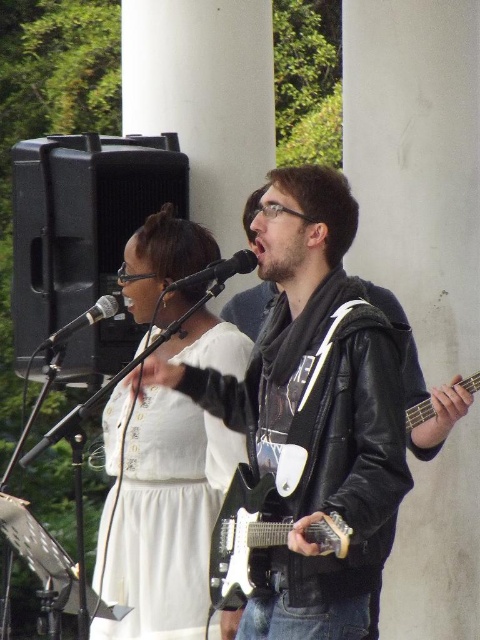
You are setting up a music stand between the black electric guitar at center and the black matte microphone at center. Which object should the stand be placed closer to if you want it to be near the larger object?

The stand should be placed closer to the black electric guitar at center because it is larger than the black matte microphone at center.

You are a photographer at the event and need to capture a closeup shot of the lead vocalist. Given that the white satin dress at center and the black matte microphone at center are both in the frame, which object should you focus on to ensure the microphone is clearly visible?

The black matte microphone at center is smaller than the white satin dress at center, so focusing on the microphone ensures its details are clear.

You are a photographer at the live musical performance and want to capture the white satin dress at center in your shot. What are the coordinates where you should focus your camera?

The coordinates for the white satin dress at center are at point (164,518).